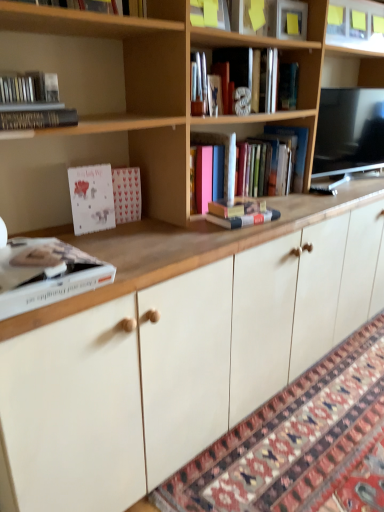
Question: Does wooden bookcase at upper center appear on the left side of hardcover book at upper left, the sixth book when ordered from right to left?

Choices:
 (A) no
 (B) yes

Answer: (A)

Question: From the image's perspective, is wooden bookcase at upper center under hardcover book at upper left, which ranks as the 2th book in left-to-right order?

Choices:
 (A) no
 (B) yes

Answer: (A)

Question: Is wooden bookcase at upper center aimed at hardcover book at upper left, which ranks as the 2th book in left-to-right order?

Choices:
 (A) no
 (B) yes

Answer: (B)

Question: Considering the relative sizes of wooden bookcase at upper center and hardcover book at upper left, which ranks as the 2th book in left-to-right order, in the image provided, is wooden bookcase at upper center bigger than hardcover book at upper left, which ranks as the 2th book in left-to-right order,?

Choices:
 (A) no
 (B) yes

Answer: (B)

Question: Considering the relative sizes of wooden bookcase at upper center and hardcover book at upper left, which ranks as the 2th book in left-to-right order, in the image provided, is wooden bookcase at upper center thinner than hardcover book at upper left, which ranks as the 2th book in left-to-right order,?

Choices:
 (A) no
 (B) yes

Answer: (A)

Question: Is hardcover book at center, acting as the fourth book starting from the right, inside the boundaries of patterned carpet at lower right, or outside?

Choices:
 (A) outside
 (B) inside

Answer: (A)

Question: Considering their positions, is hardcover book at center, which is the 4th book from left to right, located in front of or behind patterned carpet at lower right?

Choices:
 (A) behind
 (B) front

Answer: (A)

Question: From a real-world perspective, is hardcover book at center, acting as the fourth book starting from the right, positioned above or below patterned carpet at lower right?

Choices:
 (A) below
 (B) above

Answer: (B)

Question: Considering the positions of hardcover book at center, which is the 4th book from left to right, and patterned carpet at lower right in the image, is hardcover book at center, which is the 4th book from left to right, bigger or smaller than patterned carpet at lower right?

Choices:
 (A) big
 (B) small

Answer: (B)

Question: Visually, is hardcover book at center, acting as the fourth book starting from the right, positioned to the left or to the right of white matte book at lower left, acting as the 5th book starting from the right?

Choices:
 (A) left
 (B) right

Answer: (B)

Question: Is point (195, 139) positioned closer to the camera than point (23, 266)?

Choices:
 (A) farther
 (B) closer

Answer: (A)

Question: Relative to white matte book at lower left, which is the third book from left to right, is hardcover book at center, acting as the fourth book starting from the right, in front or behind?

Choices:
 (A) behind
 (B) front

Answer: (A)

Question: From a real-world perspective, relative to white matte book at lower left, which is the third book from left to right, is hardcover book at center, which is the 4th book from left to right, vertically above or below?

Choices:
 (A) below
 (B) above

Answer: (B)

Question: Considering the positions of metallic silver letter at upper center, the second book in the right-to-left sequence, and wooden bookcase at upper center in the image, is metallic silver letter at upper center, the second book in the right-to-left sequence, wider or thinner than wooden bookcase at upper center?

Choices:
 (A) thin
 (B) wide

Answer: (A)

Question: Based on their sizes in the image, would you say metallic silver letter at upper center, the second book in the right-to-left sequence, is bigger or smaller than wooden bookcase at upper center?

Choices:
 (A) small
 (B) big

Answer: (A)